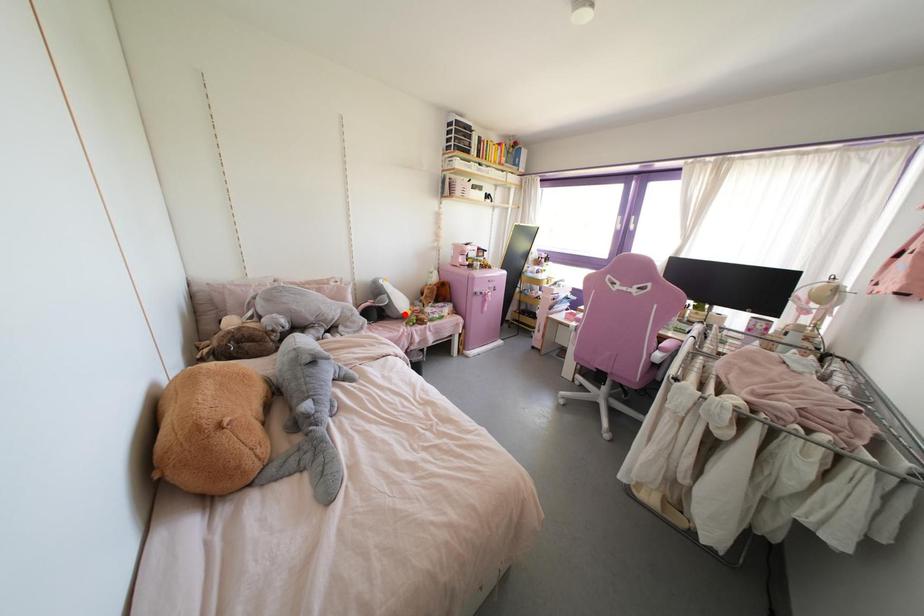
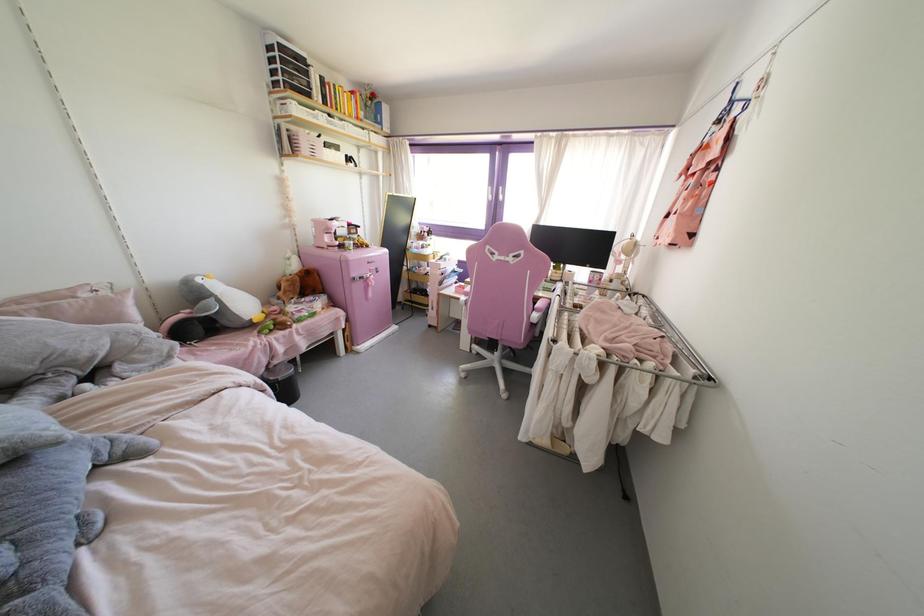
Where in the second image is the point corresponding to the highlighted location from the first image?

(254, 320)